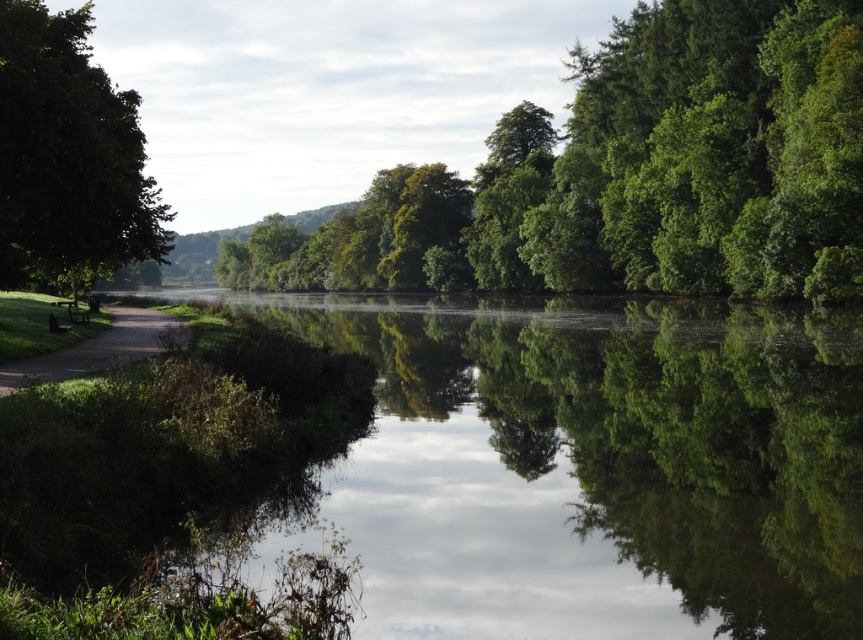
You are planning to place a new bench exactly in the middle between the green reflective water at center and the wooden park bench at left. Will the new bench fit without overlapping either object? Please consider their widths when answering.

The green reflective water at center is wider than the wooden park bench at left. Since the new bench is placed exactly in the middle, there should be sufficient space between them to fit the bench without overlapping, as the total distance between the edges would accommodate the bench.

You are standing at the center of the image and want to reach the green reflective water at center. According to the coordinates provided, in which direction should you move to reach it?

The green reflective water at center is located at coordinates point [597,465], so you should move towards the lower right direction to reach it.